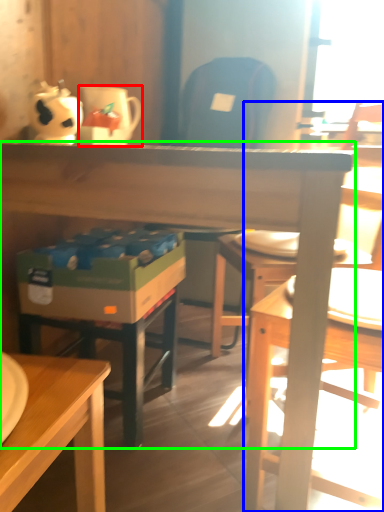
Question: Estimate the real-world distances between objects in this image. Which object is closer to coffee cup (highlighted by a red box), chair (highlighted by a blue box) or desk (highlighted by a green box)?

Choices:
 (A) chair
 (B) desk

Answer: (B)